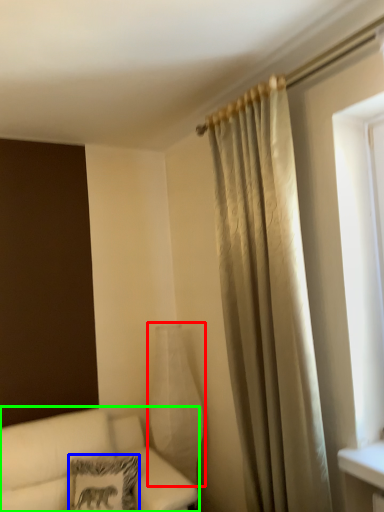
Question: Which object is positioned closest to glass vase (highlighted by a red box)? Select from pillow (highlighted by a blue box) and studio couch (highlighted by a green box).

Choices:
 (A) pillow
 (B) studio couch

Answer: (B)